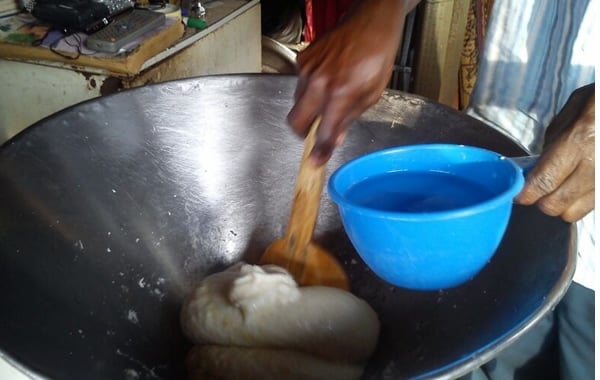
Find the location of `silver metal big pan`. silver metal big pan is located at coordinates (468, 342).